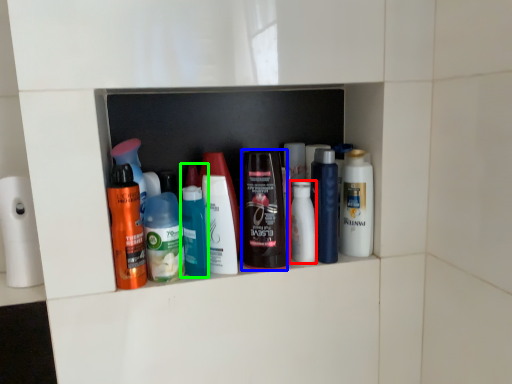
Question: Which object is positioned farthest from toiletry (highlighted by a red box)? Select from toiletry (highlighted by a blue box) and toiletry (highlighted by a green box).

Choices:
 (A) toiletry
 (B) toiletry

Answer: (B)